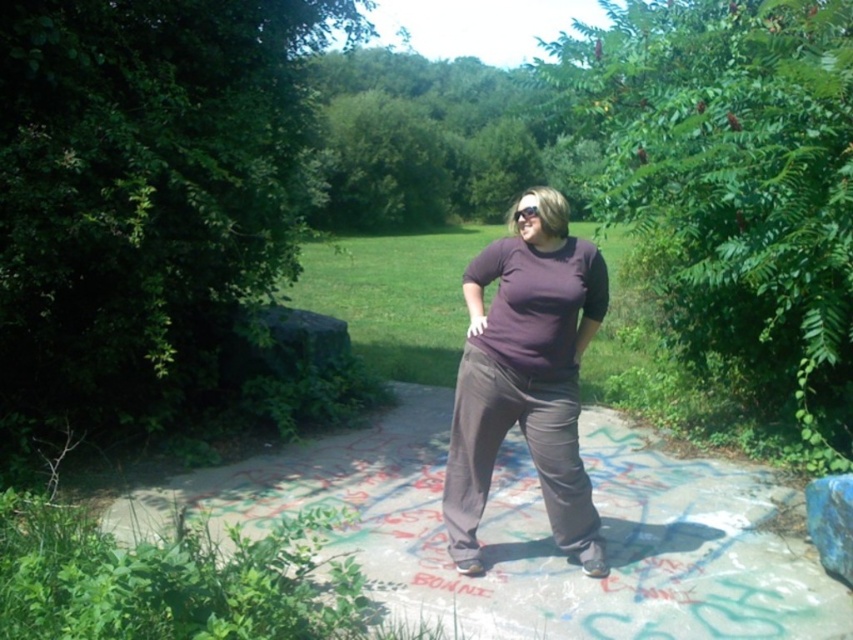
Is concrete sidewalk at center wider than purple matte shirt at center?

Indeed, concrete sidewalk at center has a greater width compared to purple matte shirt at center.

Is point (614, 541) farther from camera compared to point (496, 272)?

Yes, point (614, 541) is behind point (496, 272).

Where is `concrete sidewalk at center`? This screenshot has width=853, height=640. concrete sidewalk at center is located at coordinates (534, 532).